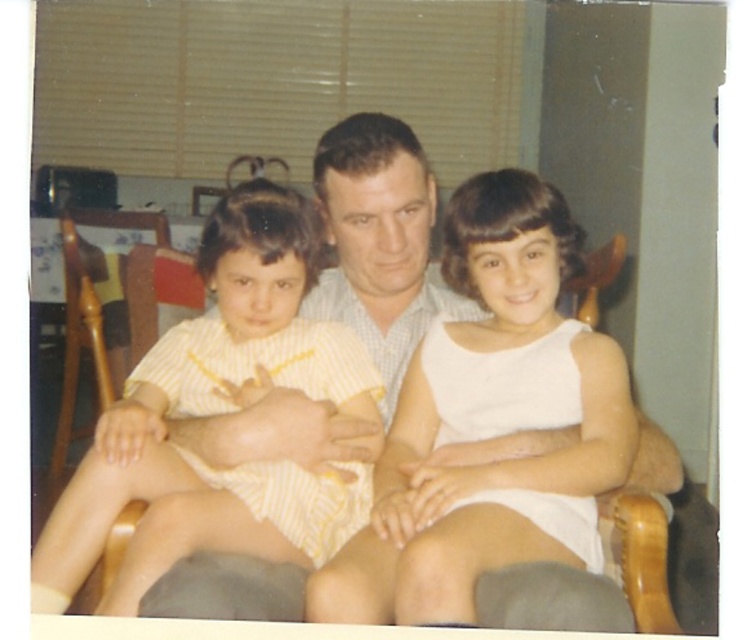
You are standing in the living room and see two points marked in the image. Which point is closer to you, point [421,516] or point [233,419]?

Point [421,516] is in front of point [233,419], so it is closer to you.